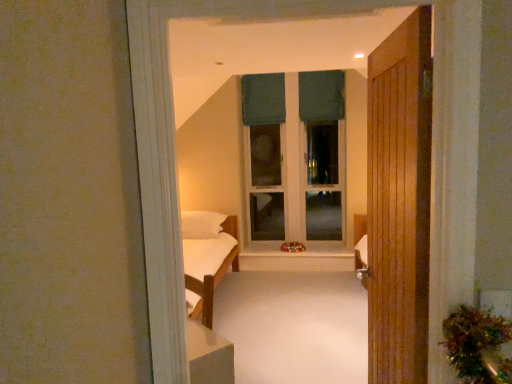
Locate an element on the screen. dark green fabric curtain at upper center, the second curtain in the right-to-left sequence is located at coordinates (263, 99).

I want to click on dark green fabric at upper center, acting as the 1th curtain starting from the right, so click(321, 96).

The height and width of the screenshot is (384, 512). Describe the element at coordinates (399, 202) in the screenshot. I see `wooden door at right` at that location.

Locate an element on the screen. This screenshot has height=384, width=512. green fabric window frame at center is located at coordinates (295, 154).

Can you confirm if dark green fabric at upper center, which appears as the second curtain when viewed from the left, is smaller than green fabric window frame at center?

Yes.

From the picture: From a real-world perspective, is dark green fabric at upper center, acting as the 1th curtain starting from the right, above or below green fabric window frame at center?

dark green fabric at upper center, acting as the 1th curtain starting from the right, is situated higher than green fabric window frame at center in the real world.

This screenshot has width=512, height=384. What are the coordinates of `window frame that appears below the dark green fabric at upper center, which appears as the second curtain when viewed from the left (from the image's perspective)` in the screenshot? It's located at (295, 154).

Which object is closer to the camera taking this photo, dark green fabric at upper center, which appears as the second curtain when viewed from the left, or green fabric window frame at center?

green fabric window frame at center is in front.

Which object is positioned more to the left, green fabric window frame at center or white wood at center?

white wood at center is more to the left.

Is green fabric window frame at center wider than white wood at center?

In fact, green fabric window frame at center might be narrower than white wood at center.

You are a GUI agent. You are given a task and a screenshot of the screen. Output one action in this format:
    pyautogui.click(x=<x>, y=<y>)
    Task: Click on the window frame on the right side of white wood at center
    
    Given the screenshot: What is the action you would take?
    pyautogui.click(x=295, y=154)

From the image's perspective, is green fabric window frame at center located above or below white wood at center?

green fabric window frame at center is above white wood at center.

From the image's perspective, is wooden door at right below dark green fabric at upper center, acting as the 1th curtain starting from the right?

Yes, from the image's perspective, wooden door at right is below dark green fabric at upper center, acting as the 1th curtain starting from the right.

Measure the distance between wooden door at right and dark green fabric at upper center, acting as the 1th curtain starting from the right.

wooden door at right is 13.20 feet from dark green fabric at upper center, acting as the 1th curtain starting from the right.

Is wooden door at right positioned in front of dark green fabric at upper center, which appears as the second curtain when viewed from the left?

Yes, it is.

Are wooden door at right and dark green fabric at upper center, acting as the 1th curtain starting from the right, beside each other?

No, wooden door at right is not touching dark green fabric at upper center, acting as the 1th curtain starting from the right.

Find the location of `curtain that is the 2nd one when counting backward from the wooden door at right`. curtain that is the 2nd one when counting backward from the wooden door at right is located at coordinates 263,99.

In terms of width, does wooden door at right look wider or thinner when compared to dark green fabric curtain at upper center, placed as the first curtain when sorted from left to right?

wooden door at right is wider than dark green fabric curtain at upper center, placed as the first curtain when sorted from left to right.

Which object is closer to the camera, wooden door at right or dark green fabric curtain at upper center, the second curtain in the right-to-left sequence?

Positioned in front is wooden door at right.

Which object is positioned more to the right, green fabric window frame at center or dark green fabric at upper center, acting as the 1th curtain starting from the right?

From the viewer's perspective, dark green fabric at upper center, acting as the 1th curtain starting from the right, appears more on the right side.

Is green fabric window frame at center surrounding dark green fabric at upper center, acting as the 1th curtain starting from the right?

Yes, dark green fabric at upper center, acting as the 1th curtain starting from the right, is inside green fabric window frame at center.

Is point (272, 120) positioned in front of point (332, 114)?

That is True.

From the picture: Is dark green fabric curtain at upper center, placed as the first curtain when sorted from left to right, to the right of dark green fabric at upper center, acting as the 1th curtain starting from the right, from the viewer's perspective?

Incorrect, dark green fabric curtain at upper center, placed as the first curtain when sorted from left to right, is not on the right side of dark green fabric at upper center, acting as the 1th curtain starting from the right.

From a real-world perspective, is dark green fabric curtain at upper center, the second curtain in the right-to-left sequence, on top of dark green fabric at upper center, which appears as the second curtain when viewed from the left?

Actually, dark green fabric curtain at upper center, the second curtain in the right-to-left sequence, is physically below dark green fabric at upper center, which appears as the second curtain when viewed from the left, in the real world.

From the image's perspective, which object appears higher, dark green fabric curtain at upper center, placed as the first curtain when sorted from left to right, or dark green fabric at upper center, which appears as the second curtain when viewed from the left?

From the image's view, dark green fabric at upper center, which appears as the second curtain when viewed from the left, is above.

How many degrees apart are the facing directions of dark green fabric curtain at upper center, placed as the first curtain when sorted from left to right, and dark green fabric at upper center, acting as the 1th curtain starting from the right?

The angular difference between dark green fabric curtain at upper center, placed as the first curtain when sorted from left to right, and dark green fabric at upper center, acting as the 1th curtain starting from the right, is 3.22 degrees.

Considering the relative sizes of green fabric window frame at center and wooden door at right in the image provided, is green fabric window frame at center shorter than wooden door at right?

No, green fabric window frame at center is not shorter than wooden door at right.

Considering the sizes of objects green fabric window frame at center and wooden door at right in the image provided, who is wider, green fabric window frame at center or wooden door at right?

green fabric window frame at center is wider.

Would you say green fabric window frame at center is a long distance from wooden door at right?

Yes, green fabric window frame at center and wooden door at right are quite far apart.

From a real-world perspective, who is located lower, green fabric window frame at center or wooden door at right?

wooden door at right, from a real-world perspective.

Starting from the green fabric window frame at center, which curtain is the 1st one behind? Please provide its 2D coordinates.

[(321, 96)]

This screenshot has height=384, width=512. I want to click on window sill in front of the green fabric window frame at center, so click(x=298, y=252).

Considering their positions, is white wood at center positioned closer to dark green fabric at upper center, which appears as the second curtain when viewed from the left, than wooden door at right?

white wood at center lies closer to dark green fabric at upper center, which appears as the second curtain when viewed from the left, than the other object.

Looking at the image, which one is located closer to wooden door at right, dark green fabric curtain at upper center, the second curtain in the right-to-left sequence, or dark green fabric at upper center, which appears as the second curtain when viewed from the left?

Based on the image, dark green fabric curtain at upper center, the second curtain in the right-to-left sequence, appears to be nearer to wooden door at right.

Based on their spatial positions, is dark green fabric at upper center, acting as the 1th curtain starting from the right, or dark green fabric curtain at upper center, placed as the first curtain when sorted from left to right, further from white wood at center?

The object further to white wood at center is dark green fabric at upper center, acting as the 1th curtain starting from the right.

Estimate the real-world distances between objects in this image. Which object is further from dark green fabric curtain at upper center, placed as the first curtain when sorted from left to right, white wood at center or dark green fabric at upper center, which appears as the second curtain when viewed from the left?

white wood at center lies further to dark green fabric curtain at upper center, placed as the first curtain when sorted from left to right, than the other object.

Estimate the real-world distances between objects in this image. Which object is closer to white wood at center, green fabric window frame at center or wooden door at right?

The object closer to white wood at center is green fabric window frame at center.

Which object lies further to the anchor point dark green fabric curtain at upper center, placed as the first curtain when sorted from left to right, wooden door at right or dark green fabric at upper center, which appears as the second curtain when viewed from the left?

wooden door at right.

Based on their spatial positions, is dark green fabric curtain at upper center, the second curtain in the right-to-left sequence, or wooden door at right closer to white wood at center?

Among the two, dark green fabric curtain at upper center, the second curtain in the right-to-left sequence, is located nearer to white wood at center.

Looking at the image, which one is located closer to wooden door at right, white wood at center or green fabric window frame at center?

white wood at center.

Where is `window frame between wooden door at right and dark green fabric curtain at upper center, placed as the first curtain when sorted from left to right, from front to back`? Image resolution: width=512 pixels, height=384 pixels. window frame between wooden door at right and dark green fabric curtain at upper center, placed as the first curtain when sorted from left to right, from front to back is located at coordinates tap(295, 154).

At what (x,y) coordinates should I click in order to perform the action: click on window frame between dark green fabric curtain at upper center, the second curtain in the right-to-left sequence, and white wood at center vertically. Please return your answer as a coordinate pair (x, y). This screenshot has height=384, width=512. Looking at the image, I should click on (295, 154).

In order to click on window sill between wooden door at right and dark green fabric at upper center, acting as the 1th curtain starting from the right, in the front-back direction in this screenshot , I will do `click(298, 252)`.

What are the coordinates of `window sill located between wooden door at right and dark green fabric curtain at upper center, the second curtain in the right-to-left sequence, in the depth direction` in the screenshot? It's located at (298, 252).